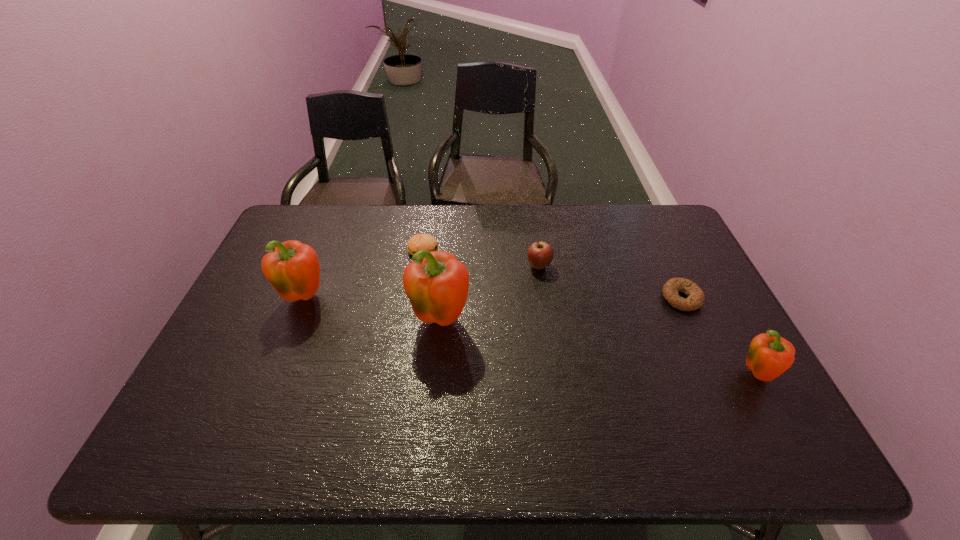
You are a GUI agent. You are given a task and a screenshot of the screen. Output one action in this format:
    pyautogui.click(x=<x>, y=<y>)
    Task: Click on the free space located 0.180m on the front of the second pepper from left to right
    The image size is (960, 540).
    Given the screenshot: What is the action you would take?
    pyautogui.click(x=433, y=406)

Locate an element on the screen. The height and width of the screenshot is (540, 960). vacant space situated on the left of the rightmost pepper is located at coordinates (617, 376).

Where is `vacant region located on the left of the patty`? The height and width of the screenshot is (540, 960). vacant region located on the left of the patty is located at coordinates (334, 251).

Locate an element on the screen. free space located 0.260m on the front of the shortest object is located at coordinates (727, 395).

This screenshot has width=960, height=540. In order to click on vacant region located 0.180m on the right of the apple in this screenshot , I will do `click(610, 266)`.

Locate an element on the screen. The height and width of the screenshot is (540, 960). object present at the far edge is located at coordinates (418, 242).

I want to click on object located at the near edge, so click(x=768, y=357).

Where is `object that is at the left edge`? This screenshot has height=540, width=960. object that is at the left edge is located at coordinates (292, 267).

Identify the location of pepper present at the right edge. This screenshot has width=960, height=540. (768, 357).

Where is `bagel that is at the right edge`? bagel that is at the right edge is located at coordinates (695, 299).